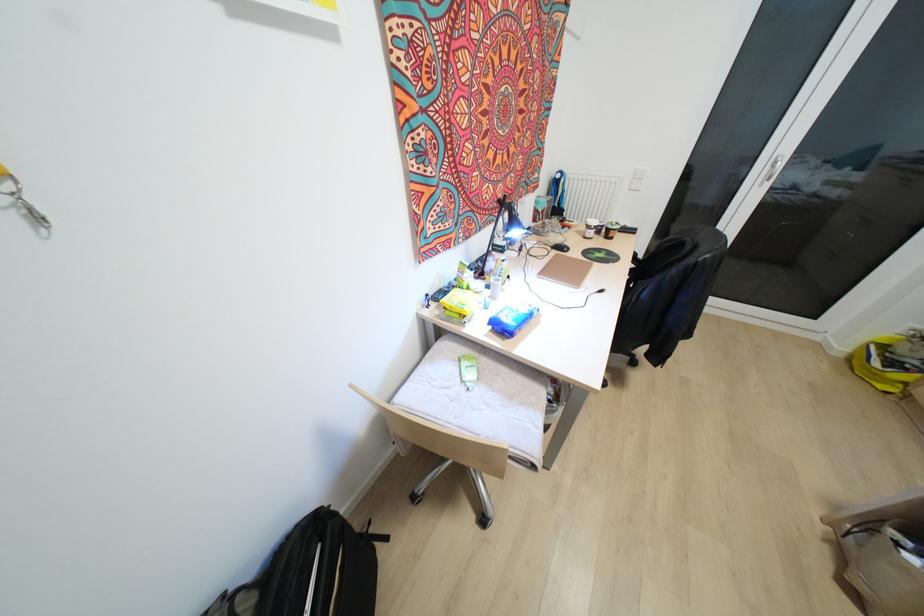
Locate an element on the screen. The image size is (924, 616). white door handle is located at coordinates (772, 169).